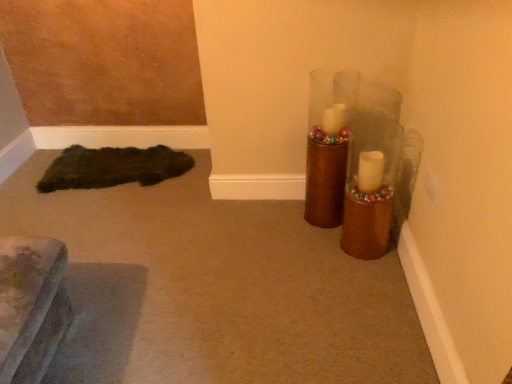
What are the coordinates of `dark fuzzy rug at lower left` in the screenshot? It's located at (113, 167).

Image resolution: width=512 pixels, height=384 pixels. What do you see at coordinates (113, 167) in the screenshot?
I see `dark fuzzy rug at lower left` at bounding box center [113, 167].

In order to face dark fuzzy rug at lower left, should I rotate leftwards or rightwards?

Turn left approximately 17.742 degrees to face it.

Locate an element on the screen. The width and height of the screenshot is (512, 384). shiny brown vase at upper right is located at coordinates (325, 184).

The width and height of the screenshot is (512, 384). What do you see at coordinates (325, 184) in the screenshot? I see `shiny brown vase at upper right` at bounding box center [325, 184].

Locate an element on the screen. Image resolution: width=512 pixels, height=384 pixels. dark fuzzy rug at lower left is located at coordinates (113, 167).

Between shiny brown vase at upper right and dark fuzzy rug at lower left, which one appears on the right side from the viewer's perspective?

shiny brown vase at upper right.

Looking at this image, relative to dark fuzzy rug at lower left, is shiny brown vase at upper right in front or behind?

Clearly, shiny brown vase at upper right is in front of dark fuzzy rug at lower left.

Which is in front, point (338, 193) or point (59, 171)?

The point (338, 193) is more forward.

From the image's perspective, is shiny brown vase at upper right below dark fuzzy rug at lower left?

Incorrect, from the image's perspective, shiny brown vase at upper right is higher than dark fuzzy rug at lower left.

From a real-world perspective, who is located higher, shiny brown vase at upper right or dark fuzzy rug at lower left?

In real-world perspective, shiny brown vase at upper right is above.

Considering the sizes of objects shiny brown vase at upper right and dark fuzzy rug at lower left in the image provided, who is thinner, shiny brown vase at upper right or dark fuzzy rug at lower left?

With smaller width is shiny brown vase at upper right.

Considering the relative sizes of shiny brown vase at upper right and dark fuzzy rug at lower left in the image provided, is shiny brown vase at upper right shorter than dark fuzzy rug at lower left?

Incorrect, the height of shiny brown vase at upper right does not fall short of that of dark fuzzy rug at lower left.

Considering the sizes of shiny brown vase at upper right and dark fuzzy rug at lower left in the image, is shiny brown vase at upper right bigger or smaller than dark fuzzy rug at lower left?

shiny brown vase at upper right is bigger than dark fuzzy rug at lower left.

Is dark fuzzy rug at lower left completely or partially inside shiny brown vase at upper right?

No.

Does shiny brown vase at upper right touch dark fuzzy rug at lower left?

They are not placed beside each other.

From the picture: Is shiny brown vase at upper right aimed at dark fuzzy rug at lower left?

No.

Locate an element on the screen. doormat that is below the shiny brown vase at upper right (from the image's perspective) is located at coordinates (113, 167).

Considering the relative positions of dark fuzzy rug at lower left and shiny brown vase at upper right in the image provided, is dark fuzzy rug at lower left to the left of shiny brown vase at upper right from the viewer's perspective?

Yes, dark fuzzy rug at lower left is to the left of shiny brown vase at upper right.

Which object is closer to the camera, dark fuzzy rug at lower left or shiny brown vase at upper right?

shiny brown vase at upper right is closer to the camera.

Does point (74, 187) come in front of point (322, 182)?

No, it is not.

From the image's perspective, is dark fuzzy rug at lower left located beneath shiny brown vase at upper right?

Yes.

From a real-world perspective, does dark fuzzy rug at lower left sit lower than shiny brown vase at upper right?

Yes.

Looking at their sizes, would you say dark fuzzy rug at lower left is wider or thinner than shiny brown vase at upper right?

dark fuzzy rug at lower left is wider than shiny brown vase at upper right.

Between dark fuzzy rug at lower left and shiny brown vase at upper right, which one has less height?

dark fuzzy rug at lower left.

Considering the sizes of objects dark fuzzy rug at lower left and shiny brown vase at upper right in the image provided, who is smaller, dark fuzzy rug at lower left or shiny brown vase at upper right?

With smaller size is dark fuzzy rug at lower left.

Is dark fuzzy rug at lower left inside the boundaries of shiny brown vase at upper right, or outside?

dark fuzzy rug at lower left lies outside shiny brown vase at upper right.

Is dark fuzzy rug at lower left far from shiny brown vase at upper right?

dark fuzzy rug at lower left is far away from shiny brown vase at upper right.

Is dark fuzzy rug at lower left aimed at shiny brown vase at upper right?

No, dark fuzzy rug at lower left is not facing towards shiny brown vase at upper right.

How distant is dark fuzzy rug at lower left from shiny brown vase at upper right?

The distance of dark fuzzy rug at lower left from shiny brown vase at upper right is 3.79 feet.

The image size is (512, 384). I want to click on doormat lying below the shiny brown vase at upper right (from the image's perspective), so [x=113, y=167].

Where is `candle holder on the right of dark fuzzy rug at lower left`? The height and width of the screenshot is (384, 512). candle holder on the right of dark fuzzy rug at lower left is located at coordinates (325, 184).

You are a GUI agent. You are given a task and a screenshot of the screen. Output one action in this format:
    pyautogui.click(x=<x>, y=<y>)
    Task: Click on the doormat located below the shiny brown vase at upper right (from the image's perspective)
    The image size is (512, 384).
    Given the screenshot: What is the action you would take?
    pyautogui.click(x=113, y=167)